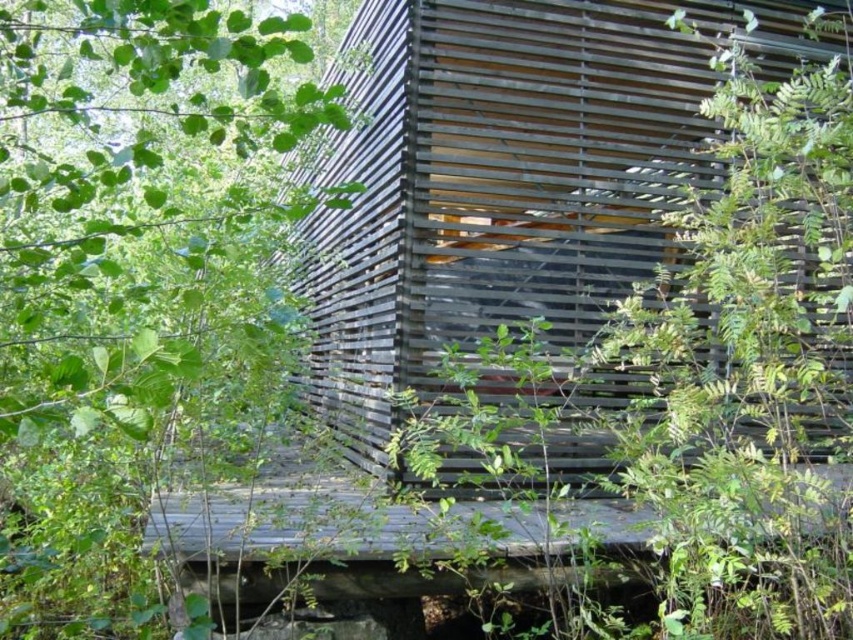
In the scene shown: You are standing at the entrance of the modern wooden structure and notice a point marked at coordinates (136,280). What object is located at this point?

The point at coordinates (136,280) marks a green leafy tree at the left.